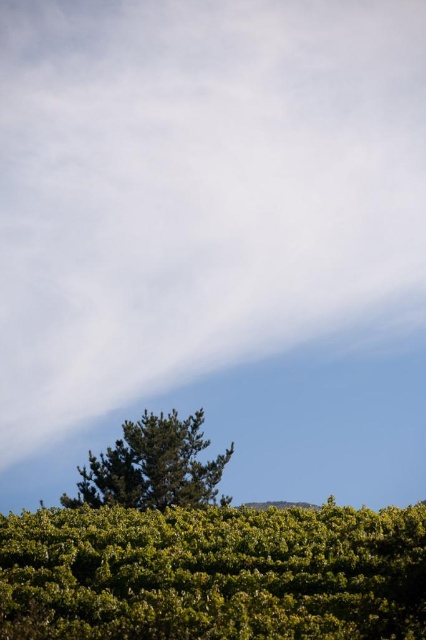
Which is in front, point (379, 524) or point (104, 484)?

Positioned in front is point (379, 524).

Who is lower down, green leafy bush at lower center or green textured tree at lower center?

green textured tree at lower center

Is point (157, 596) positioned in front of point (192, 413)?

Yes, point (157, 596) is closer to viewer.

The image size is (426, 640). I want to click on green leafy bush at lower center, so click(x=213, y=573).